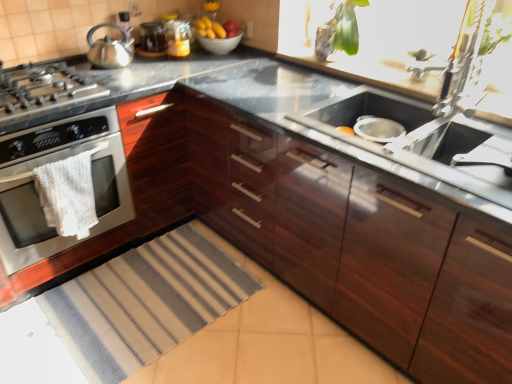
Identify the location of unoccupied region to the right of polished stainless steel kettle at left. The image size is (512, 384). (147, 65).